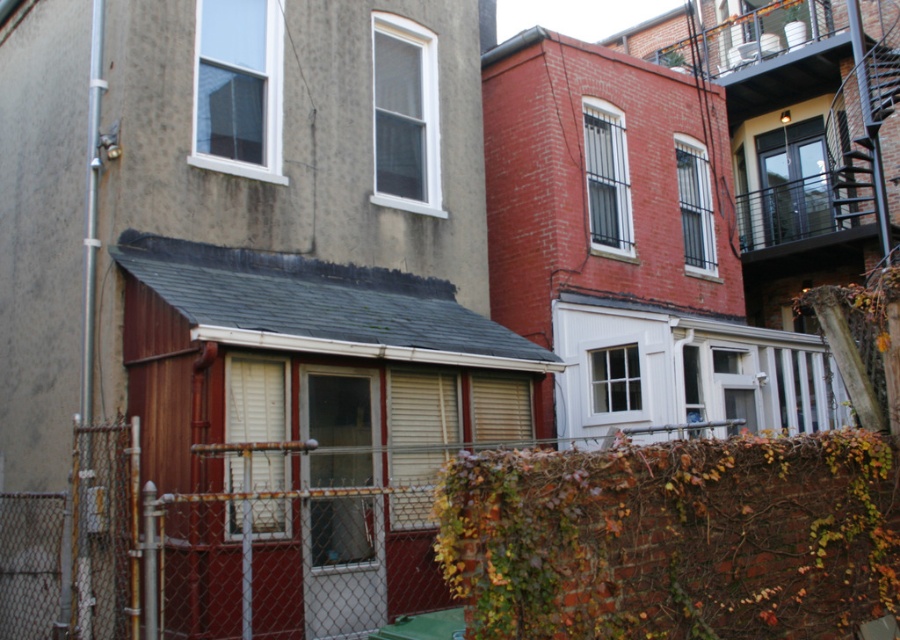
Question: Does rusty chain-link fence at lower center lie behind black metal fire escape at upper right?

Choices:
 (A) no
 (B) yes

Answer: (A)

Question: Which point is closer to the camera?

Choices:
 (A) (711, 65)
 (B) (108, 476)

Answer: (B)

Question: Which object is closer to the camera taking this photo?

Choices:
 (A) black metal fire escape at upper right
 (B) rusty chain-link fence at lower center

Answer: (B)

Question: Which point appears farthest from the camera in this image?

Choices:
 (A) (848, 35)
 (B) (41, 598)

Answer: (A)

Question: Is rusty chain-link fence at lower center further to the viewer compared to black metal fire escape at upper right?

Choices:
 (A) no
 (B) yes

Answer: (A)

Question: Can you confirm if rusty chain-link fence at lower center is positioned below black metal fire escape at upper right?

Choices:
 (A) yes
 (B) no

Answer: (A)